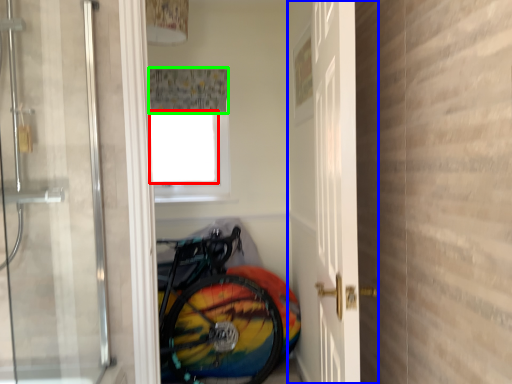
Question: Based on their relative distances, which object is nearer to window screen (highlighted by a red box)? Choose from door (highlighted by a blue box) and shower curtain (highlighted by a green box).

Choices:
 (A) door
 (B) shower curtain

Answer: (B)